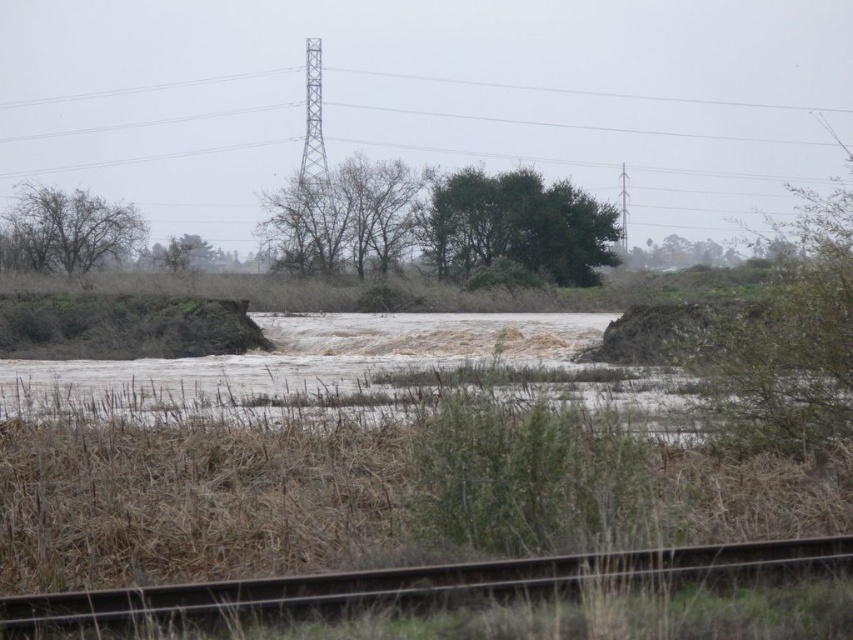
You are a hiker trying to cross the flooded area shown in the image. You notice two landmarks at the center of your view. One is a green leafy tree at center and the other is bare branches at center. Which landmark has a narrower trunk? Please choose between the two.

The green leafy tree at center is thinner than bare branches at center, so the green leafy tree at center has a narrower trunk.

You are standing at the bottom edge of the image near the railway track. You want to reach the green leafy tree at center. Which direction should you move in to get there?

The green leafy tree at center is located at point (518,227), so you should move towards the center of the image from the bottom edge to reach it.

You are standing at the bottom edge of the image near the railway track and want to reach the green leafy tree at center. Which direction should you move to get there?

The green leafy tree at center is located at point (518,227), so you should move towards the center of the image from the bottom edge where the railway track is located.